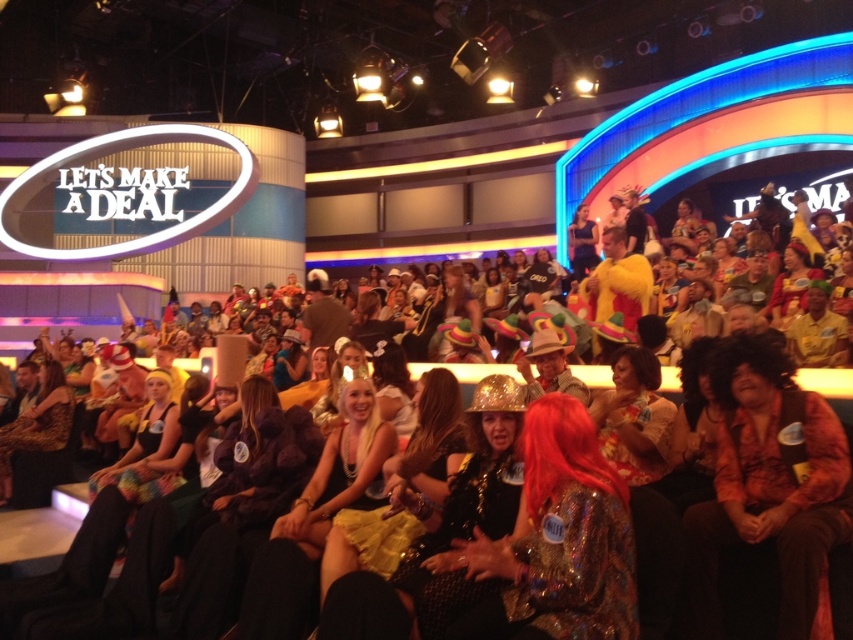
In the scene from the game show set, where exactly is the shiny metallic hat at center located in terms of coordinates?

The shiny metallic hat at center is located at point coordinates of 0.847 and 0.655.

You are a contestant on the game show and you see the orange textured shirt at center and the shiny metallic hat at center. Which object is located to the right of the other?

The orange textured shirt at center is positioned on the right side of shiny metallic hat at center, so the orange textured shirt at center is to the right of the shiny metallic hat at center.

You are a contestant on the game show and need to choose between two items in front of you. The orange textured shirt at center and the shiny metallic hat at center. Which item is taller?

The orange textured shirt at center is much taller than the shiny metallic hat at center.